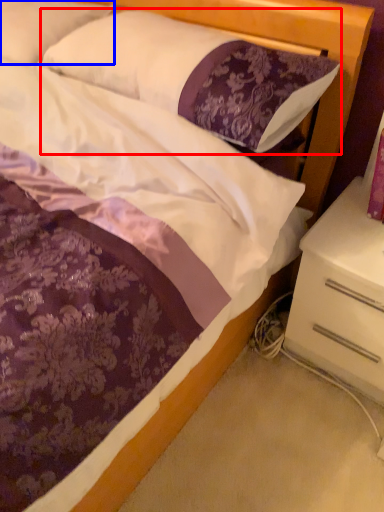
Question: Among these objects, which one is farthest to the camera, pillow (highlighted by a red box) or pillow (highlighted by a blue box)?

Choices:
 (A) pillow
 (B) pillow

Answer: (B)